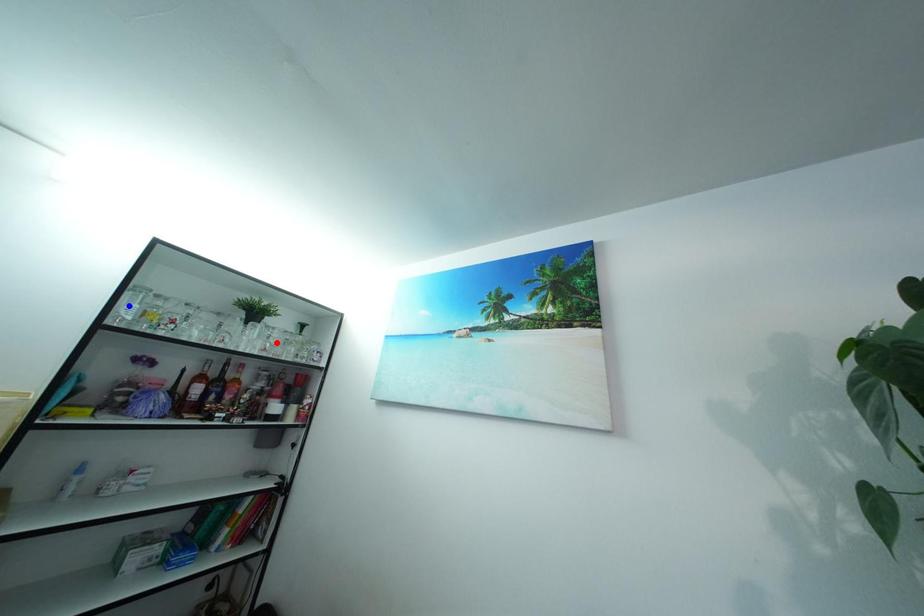
Question: Two points are marked on the image. Which point is closer to the camera?

Choices:
 (A) Blue point is closer.
 (B) Red point is closer.

Answer: (A)